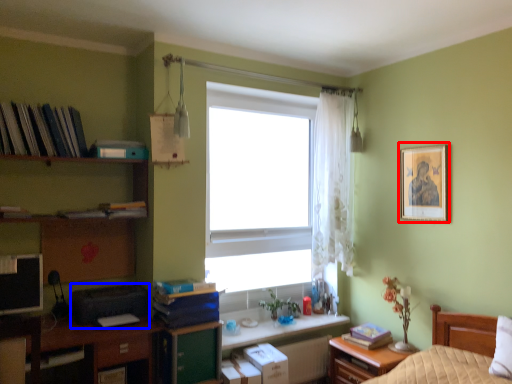
Question: Which of the following is the closest to the observer, picture frame (highlighted by a red box) or printer (highlighted by a blue box)?

Choices:
 (A) picture frame
 (B) printer

Answer: (B)